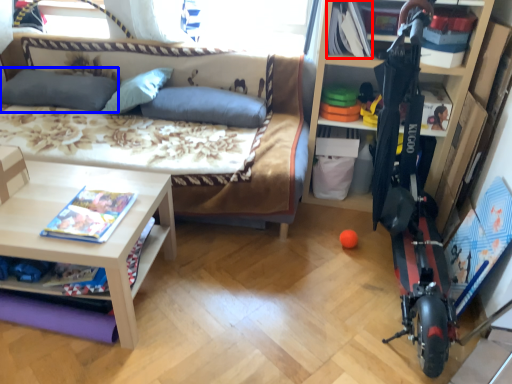
Question: Among these objects, which one is farthest to the camera, book (highlighted by a red box) or pillow (highlighted by a blue box)?

Choices:
 (A) book
 (B) pillow

Answer: (B)